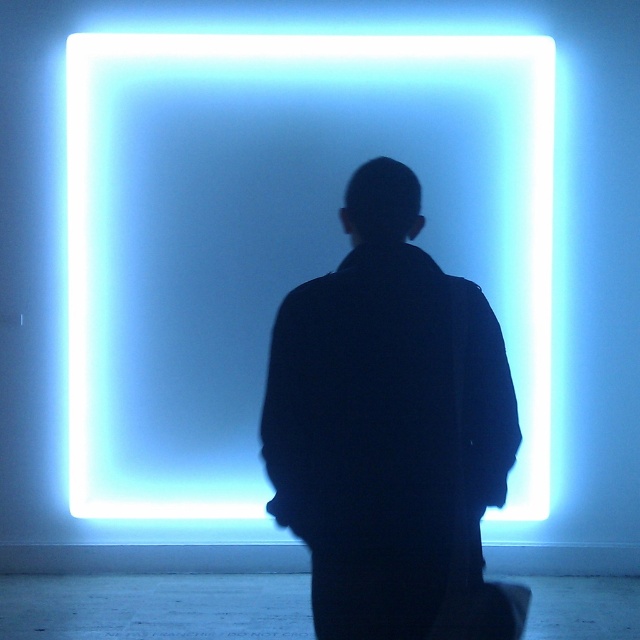
Question: Is blue neon square at center positioned in front of black matte jacket at center?

Choices:
 (A) no
 (B) yes

Answer: (A)

Question: Can you confirm if blue neon square at center is thinner than black matte jacket at center?

Choices:
 (A) yes
 (B) no

Answer: (B)

Question: Which point is farther to the camera?

Choices:
 (A) blue neon square at center
 (B) black matte jacket at center

Answer: (A)

Question: Observing the image, what is the correct spatial positioning of blue neon square at center in reference to black matte jacket at center?

Choices:
 (A) right
 (B) left

Answer: (B)